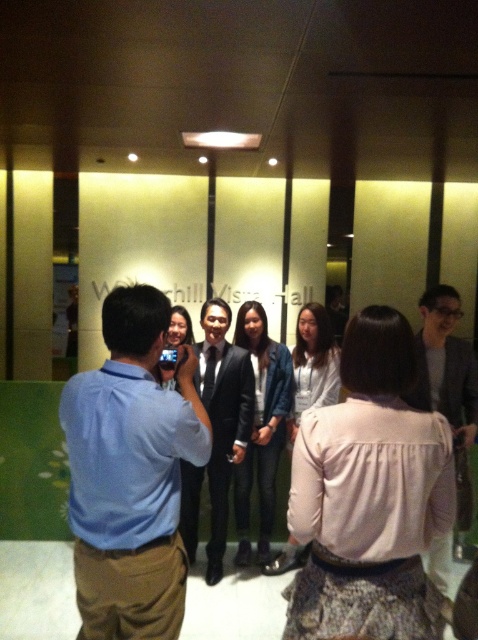
You are standing in the Worship Hall and want to place a 10 feet long banner along the floor from your current position to the point labeled point (221, 358). Will the banner reach that point?

The point (221, 358) is 12.00 feet away from the viewer. Since the banner is only 10 feet long, it will not reach the point.